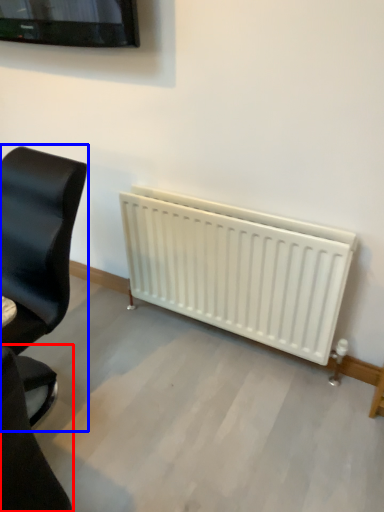
Question: Among these objects, which one is nearest to the camera, chair (highlighted by a red box) or chair (highlighted by a blue box)?

Choices:
 (A) chair
 (B) chair

Answer: (A)